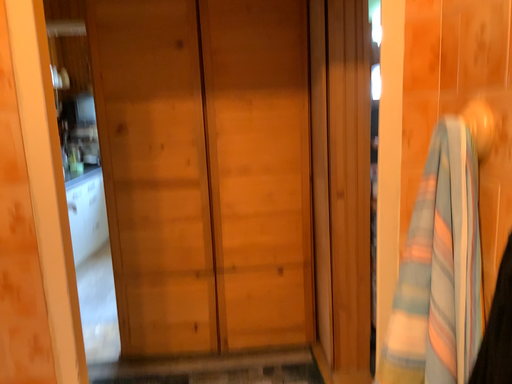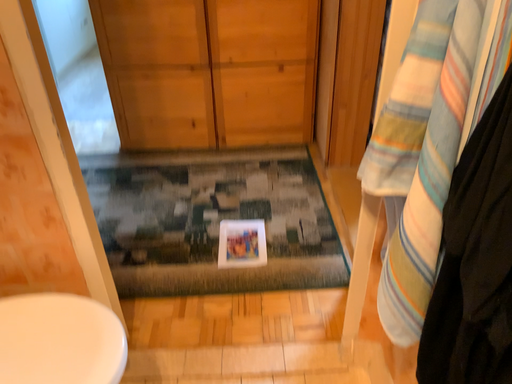
Question: Which way did the camera rotate in the video?

Choices:
 (A) rotated downward
 (B) rotated upward

Answer: (A)